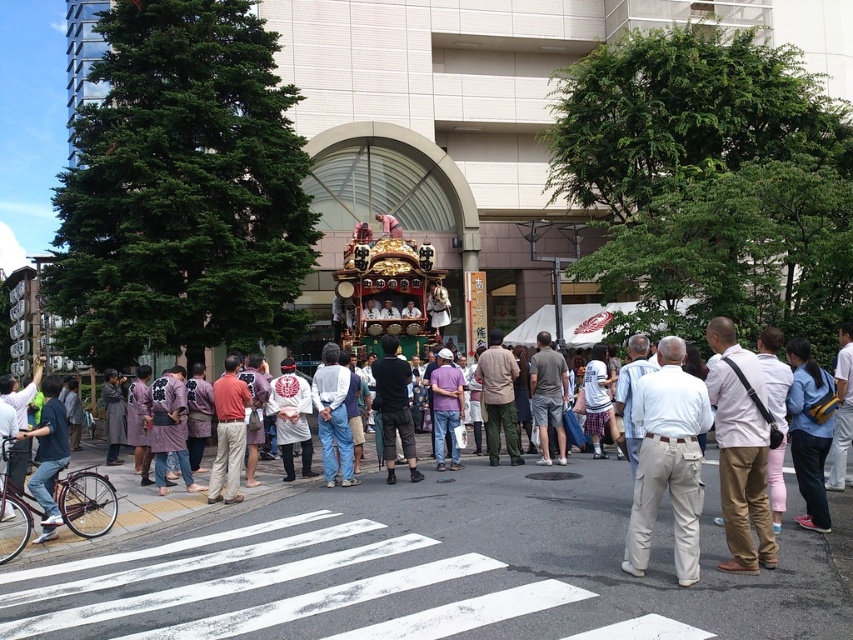
Question: Is beige cotton pants at center thinner than blue fabric pants at lower right?

Choices:
 (A) yes
 (B) no

Answer: (B)

Question: Which object is closer to the camera taking this photo?

Choices:
 (A) light brown canvas bag at center right
 (B) black cotton pants at center

Answer: (A)

Question: Which of these objects is positioned closest to the beige cotton pants at center?

Choices:
 (A) denim pants at center
 (B) white matte jacket at center
 (C) gray cotton t-shirt at center

Answer: (C)

Question: Is blue fabric pants at lower right in front of khaki cotton pants at center?

Choices:
 (A) yes
 (B) no

Answer: (A)

Question: Which point is closer to the camera?

Choices:
 (A) blue fabric pants at lower right
 (B) beige cotton pants at center
 (C) light brown canvas bag at center right

Answer: (B)

Question: Is light brown canvas bag at center right wider than denim jeans at left?

Choices:
 (A) no
 (B) yes

Answer: (A)